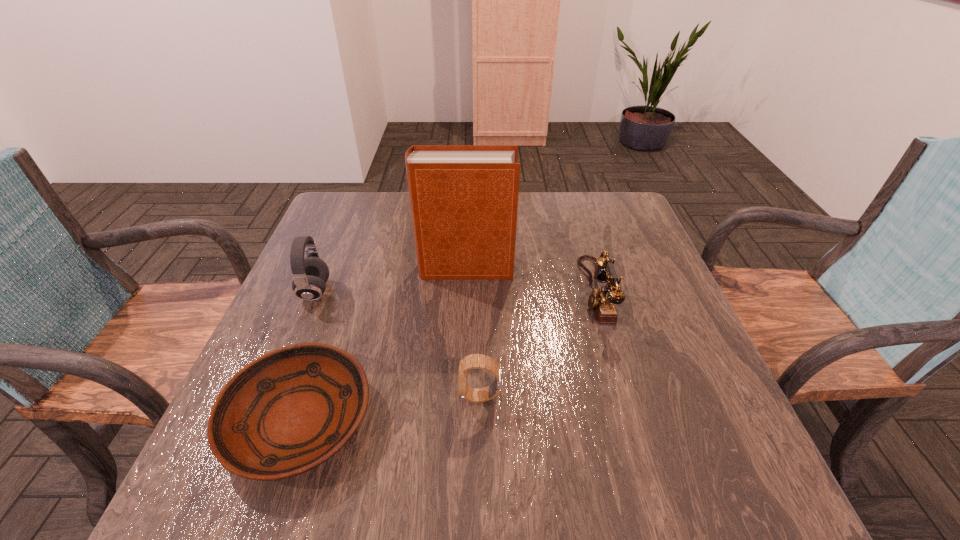
You are a GUI agent. You are given a task and a screenshot of the screen. Output one action in this format:
    pyautogui.click(x=<x>, y=<y>)
    Task: Click on the hardback book
    Image resolution: width=960 pixels, height=540 pixels.
    Given the screenshot: What is the action you would take?
    pyautogui.click(x=464, y=198)

This screenshot has width=960, height=540. Find the location of `headset`. headset is located at coordinates (310, 274).

I want to click on the rightmost object, so click(x=602, y=301).

I want to click on watch, so coord(474,361).

You are a GUI agent. You are given a task and a screenshot of the screen. Output one action in this format:
    pyautogui.click(x=<x>, y=<y>)
    Task: Click on the plate
    
    Given the screenshot: What is the action you would take?
    pyautogui.click(x=285, y=413)

Where is `vacant space located on the open cover of the hardback book`? vacant space located on the open cover of the hardback book is located at coordinates (636, 268).

Find the location of a particular element. The width and height of the screenshot is (960, 540). vacant space situated 0.120m on the ear cups of the second tallest object is located at coordinates (381, 291).

Where is `blank space located 0.110m on the front-facing side of the telephone`? blank space located 0.110m on the front-facing side of the telephone is located at coordinates pos(537,292).

I want to click on vacant space located 0.160m on the front-facing side of the telephone, so click(516, 292).

You are a GUI agent. You are given a task and a screenshot of the screen. Output one action in this format:
    pyautogui.click(x=<x>, y=<y>)
    Task: Click on the free space located on the front-facing side of the telephone
    The width and height of the screenshot is (960, 540).
    Given the screenshot: What is the action you would take?
    (448, 292)